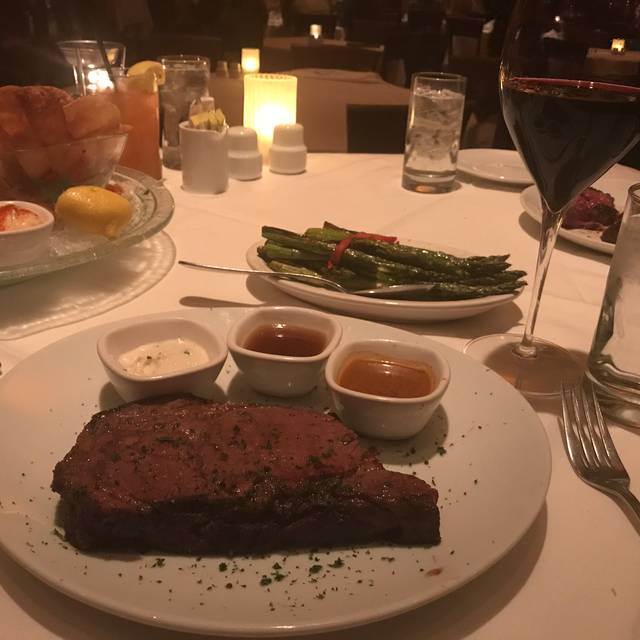
Where is `stem of glass`? stem of glass is located at coordinates (527, 313).